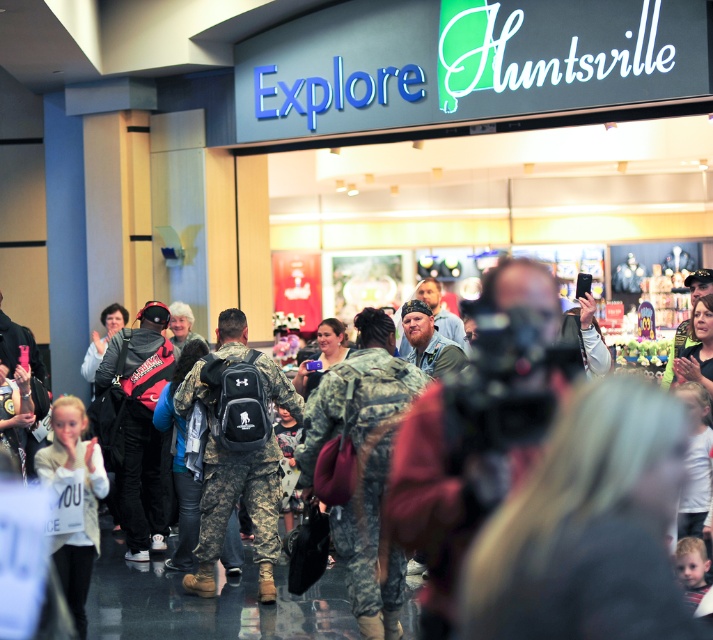
Between camouflage backpack at center and white cotton shirt at lower left, which one is positioned lower?

white cotton shirt at lower left

This screenshot has width=713, height=640. What are the coordinates of `camouflage backpack at center` in the screenshot? It's located at (237, 449).

I want to click on camouflage backpack at center, so click(x=237, y=449).